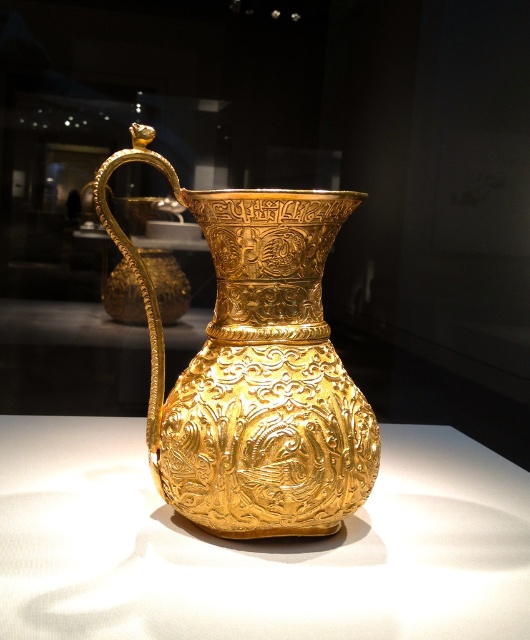
Is polished gold vase at center closer to the viewer compared to gold textured jug at center?

Yes, it is.

Where is `polished gold vase at center`? Image resolution: width=530 pixels, height=640 pixels. polished gold vase at center is located at coordinates (257, 547).